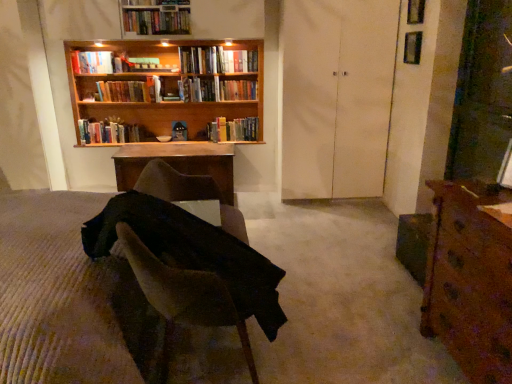
Image resolution: width=512 pixels, height=384 pixels. Identify the location of vacant area on top of hardcover books at center, arranged as the third book when viewed from the top (from a real-world perspective). (200, 50).